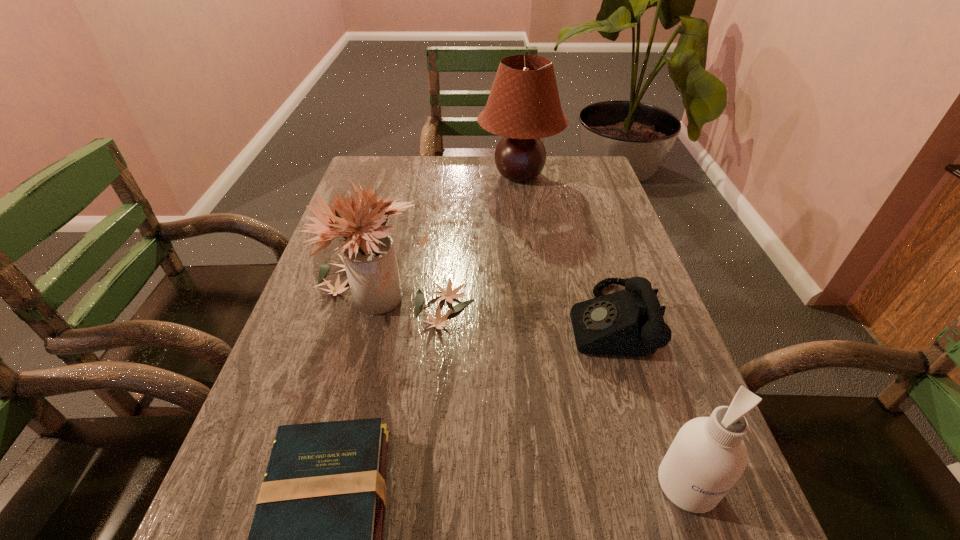
Identify the location of free region at the right edge of the desktop. Image resolution: width=960 pixels, height=540 pixels. (698, 415).

In the image, there is a desktop. At what (x,y) coordinates should I click in order to perform the action: click on vacant area at the far left corner. Please return your answer as a coordinate pair (x, y). Looking at the image, I should click on (406, 158).

In the image, there is a desktop. Where is `vacant space at the far right corner`? The width and height of the screenshot is (960, 540). vacant space at the far right corner is located at coordinates (592, 165).

The image size is (960, 540). In order to click on blank region between the second tallest object and the fourth tallest object in this screenshot , I will do `click(501, 307)`.

Image resolution: width=960 pixels, height=540 pixels. Find the location of `vacant area between the lampshade and the bouquet`. vacant area between the lampshade and the bouquet is located at coordinates (456, 234).

Identify which object is the third nearest to the third shortest object. Please provide its 2D coordinates. Your answer should be formatted as a tuple, i.e. [(x, y)], where the tuple contains the x and y coordinates of a point satisfying the conditions above.

[(316, 539)]

Where is `object identified as the fourth closest to the hardback book`? This screenshot has width=960, height=540. object identified as the fourth closest to the hardback book is located at coordinates (523, 106).